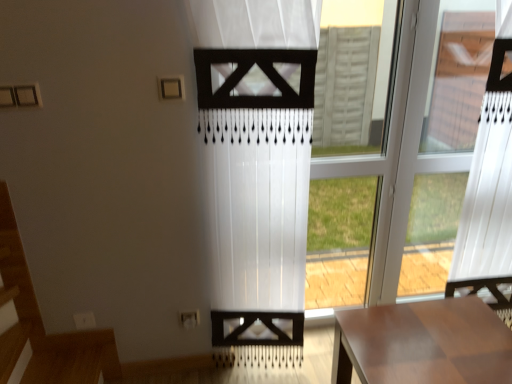
Question: From the image's perspective, is wooden table at lower right located above white sheer curtain at center?

Choices:
 (A) no
 (B) yes

Answer: (A)

Question: Is wooden table at lower right further to camera compared to white sheer curtain at center?

Choices:
 (A) yes
 (B) no

Answer: (A)

Question: Does wooden table at lower right have a lesser height compared to white sheer curtain at center?

Choices:
 (A) yes
 (B) no

Answer: (A)

Question: Is wooden table at lower right oriented away from white sheer curtain at center?

Choices:
 (A) no
 (B) yes

Answer: (A)

Question: Is wooden table at lower right oriented towards white sheer curtain at center?

Choices:
 (A) yes
 (B) no

Answer: (B)

Question: Is wooden table at lower right far away from white sheer curtain at center?

Choices:
 (A) no
 (B) yes

Answer: (A)

Question: Can you confirm if white sheer curtain at center is positioned to the left of wooden table at lower right?

Choices:
 (A) no
 (B) yes

Answer: (B)

Question: Is white sheer curtain at center smaller than wooden table at lower right?

Choices:
 (A) no
 (B) yes

Answer: (B)

Question: Is white sheer curtain at center not near wooden table at lower right?

Choices:
 (A) no
 (B) yes

Answer: (A)

Question: From the image's perspective, is white sheer curtain at center below wooden table at lower right?

Choices:
 (A) no
 (B) yes

Answer: (A)

Question: Is white sheer curtain at center facing away from wooden table at lower right?

Choices:
 (A) no
 (B) yes

Answer: (A)

Question: Is white sheer curtain at center thinner than wooden table at lower right?

Choices:
 (A) yes
 (B) no

Answer: (A)

Question: From the image's perspective, is wooden table at lower right over transparent glass window at center?

Choices:
 (A) yes
 (B) no

Answer: (B)